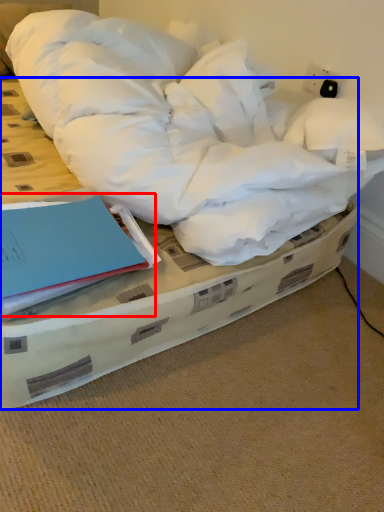
Question: Among these objects, which one is nearest to the camera, paperback book (highlighted by a red box) or bed (highlighted by a blue box)?

Choices:
 (A) paperback book
 (B) bed

Answer: (B)